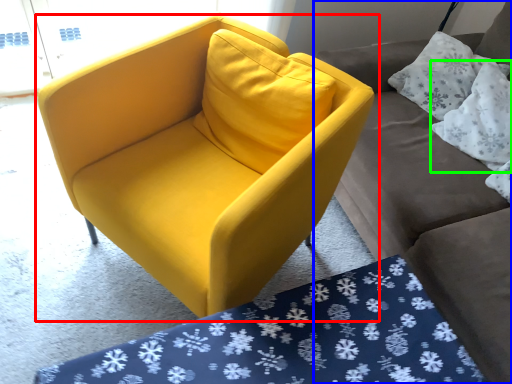
Question: Which object is positioned closest to chair (highlighted by a red box)? Select from studio couch (highlighted by a blue box) and pillow (highlighted by a green box).

Choices:
 (A) studio couch
 (B) pillow

Answer: (A)